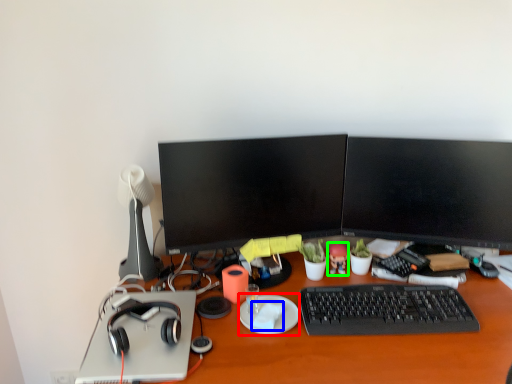
Question: Which object is the farthest from plate (highlighted by a red box)? Choose among these: notepad (highlighted by a blue box) or toy (highlighted by a green box).

Choices:
 (A) notepad
 (B) toy

Answer: (B)